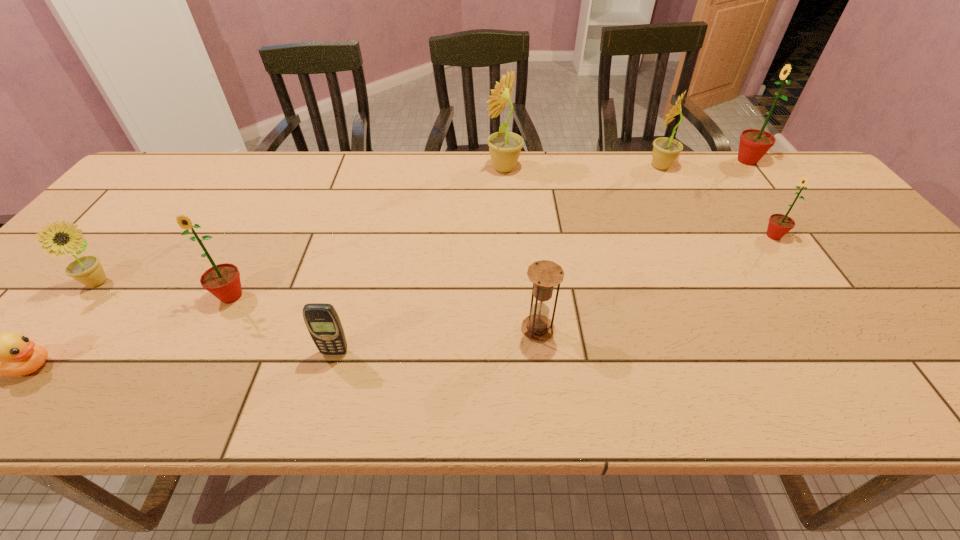
Identify the location of blank region between the second yellow sunflower from left to right and the second green sunflower from left to right. (638, 202).

I want to click on empty location between the seventh farthest object and the second biggest yellow sunflower, so click(x=599, y=247).

Image resolution: width=960 pixels, height=540 pixels. I want to click on free space between the second biggest yellow sunflower and the nearest yellow sunflower, so click(x=379, y=225).

Locate an element on the screen. This screenshot has height=540, width=960. vacant area between the seventh farthest object and the third object from right to left is located at coordinates (599, 247).

The width and height of the screenshot is (960, 540). Find the location of `free point between the hourglass and the sixth object from right to left`. free point between the hourglass and the sixth object from right to left is located at coordinates (436, 340).

Identify the location of free point between the cellular telephone and the rightmost green sunflower. This screenshot has width=960, height=540. (540, 256).

This screenshot has width=960, height=540. Identify the location of empty location between the leftmost sunflower and the rightmost yellow sunflower. (379, 225).

This screenshot has height=540, width=960. I want to click on free space between the eighth tallest object and the biggest yellow sunflower, so click(x=420, y=260).

Locate which object is the closest to the brown hourglass. Please provide its 2D coordinates. Your answer should be formatted as a tuple, i.e. [(x, y)], where the tuple contains the x and y coordinates of a point satisfying the conditions above.

[(322, 321)]

Locate an element on the screen. The image size is (960, 540). the sixth closest object to the fourth object from left to right is located at coordinates (666, 150).